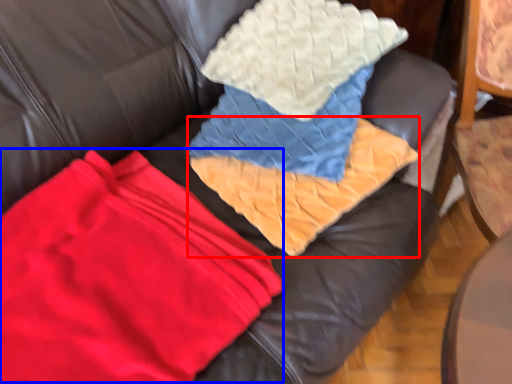
Question: Which of the following is the closest to the observer, blanket (highlighted by a red box) or fabric (highlighted by a blue box)?

Choices:
 (A) blanket
 (B) fabric

Answer: (B)